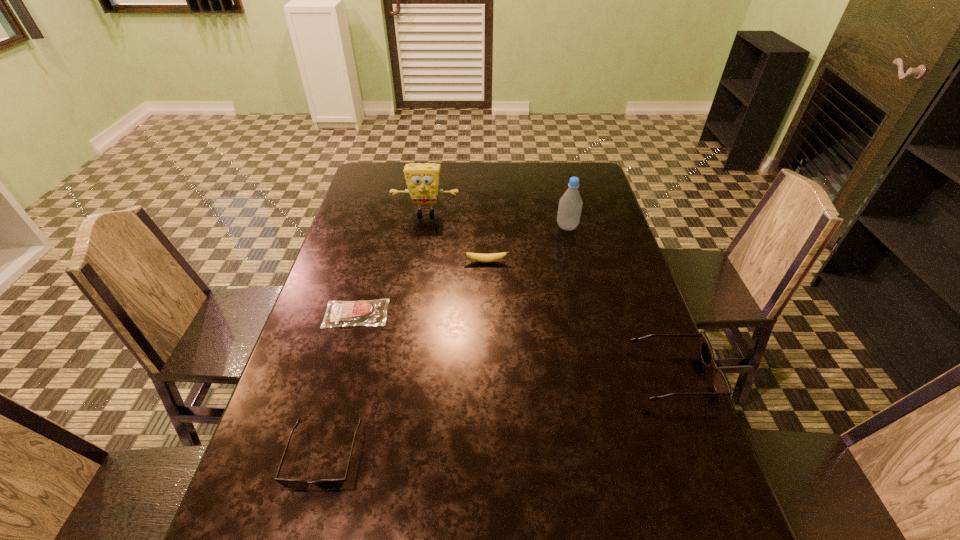
At what (x,y) coordinates should I click in order to perform the action: click on bottle located in the right edge section of the desktop. Please return your answer as a coordinate pair (x, y). Looking at the image, I should click on (570, 204).

Locate an element on the screen. This screenshot has width=960, height=540. object located in the near left corner section of the desktop is located at coordinates (294, 484).

Identify the location of free space at the far edge. This screenshot has height=540, width=960. (484, 185).

Identify the location of vacant space at the left edge of the desktop. (388, 214).

This screenshot has height=540, width=960. Identify the location of vacant space at the right edge of the desktop. (613, 367).

Find the location of a particular element. vacant region at the far right corner of the desktop is located at coordinates (588, 173).

Where is `free spot between the third nearest object and the left sunglasses`? The height and width of the screenshot is (540, 960). free spot between the third nearest object and the left sunglasses is located at coordinates (341, 384).

Identify the location of free space between the second shortest object and the taller sunglasses. (580, 319).

Image resolution: width=960 pixels, height=540 pixels. I want to click on unoccupied area between the farthest object and the farther sunglasses, so click(550, 294).

Where is `vacant space in between the left sunglasses and the fourth nearest object`? vacant space in between the left sunglasses and the fourth nearest object is located at coordinates (405, 359).